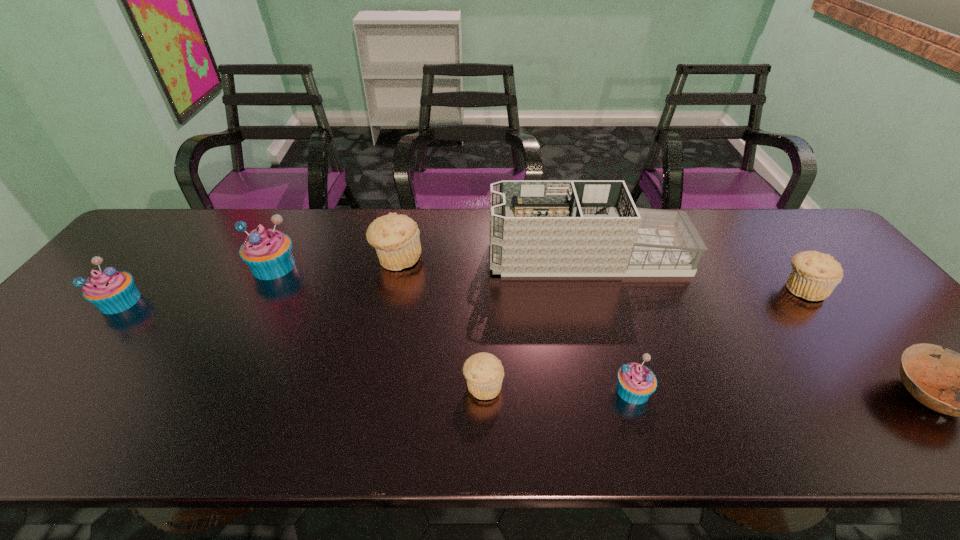
Find the location of a particular element. the nearest blue muffin is located at coordinates (635, 384).

You are a GUI agent. You are given a task and a screenshot of the screen. Output one action in this format:
    pyautogui.click(x=<x>, y=<y>)
    Task: Click on the smallest beige muffin
    
    Given the screenshot: What is the action you would take?
    pyautogui.click(x=484, y=372)

This screenshot has height=540, width=960. Find the location of `the nearest beige muffin`. the nearest beige muffin is located at coordinates (484, 372).

Image resolution: width=960 pixels, height=540 pixels. What are the coordinates of `free spot located at the entrance of the tallest object` in the screenshot? It's located at click(448, 256).

Where is `free space located 0.320m at the entrance of the tallest object`? This screenshot has height=540, width=960. free space located 0.320m at the entrance of the tallest object is located at coordinates (381, 256).

Where is `free spot located at the entrance of the tallest object`? This screenshot has height=540, width=960. free spot located at the entrance of the tallest object is located at coordinates (445, 256).

The height and width of the screenshot is (540, 960). Find the location of `vacant area situated on the front of the seventh object from right to left`. vacant area situated on the front of the seventh object from right to left is located at coordinates (206, 397).

Locate an element on the screen. The image size is (960, 540). free space located 0.080m on the front of the third object from left to right is located at coordinates (390, 296).

At what (x,y) coordinates should I click in order to perform the action: click on vacant space situated 0.120m on the back of the leftmost muffin. Please return your answer as a coordinate pair (x, y). The width and height of the screenshot is (960, 540). Looking at the image, I should click on (156, 258).

In order to click on free space located 0.310m on the back of the rightmost beige muffin in this screenshot , I will do `click(744, 211)`.